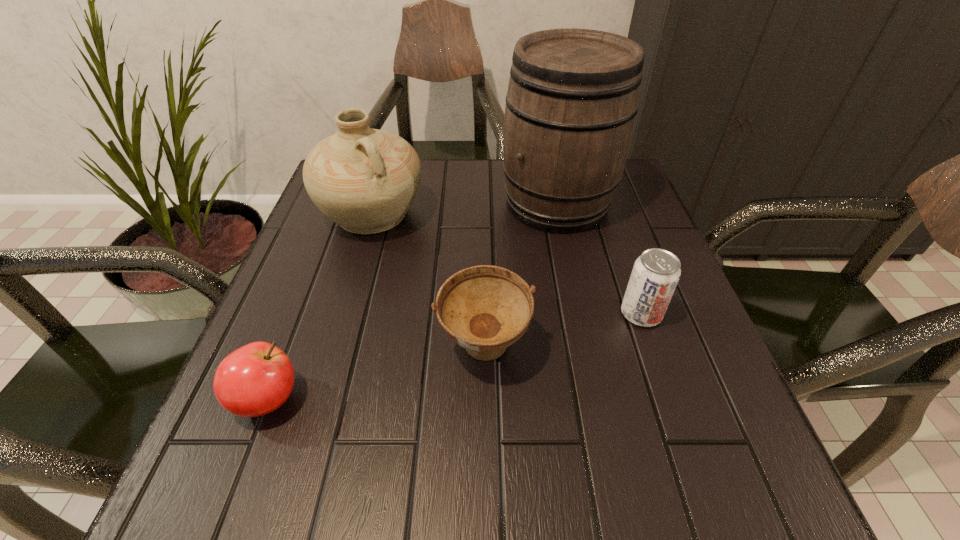
Identify the location of wine bucket. This screenshot has height=540, width=960. (573, 96).

What are the coordinates of `the fourth shortest object` in the screenshot? It's located at (365, 180).

The width and height of the screenshot is (960, 540). What are the coordinates of `soup bowl` in the screenshot? It's located at (484, 309).

I want to click on soda can, so click(x=655, y=275).

Where is `apple`? This screenshot has height=540, width=960. apple is located at coordinates (256, 379).

At what (x,y) coordinates should I click in order to perform the action: click on vacant region located 0.180m on the front of the tallest object. Please return your answer as a coordinate pair (x, y). This screenshot has width=960, height=540. Looking at the image, I should click on (577, 298).

The width and height of the screenshot is (960, 540). What are the coordinates of `vacant space located 0.200m on the right of the pottery` in the screenshot? It's located at (510, 215).

Identify the location of free space located 0.280m on the back of the soup bowl. This screenshot has height=540, width=960. (483, 225).

Identify the location of vacant space located on the left of the soda can. (503, 314).

Locate an element on the screen. This screenshot has height=540, width=960. free location located on the right of the shortest object is located at coordinates (504, 399).